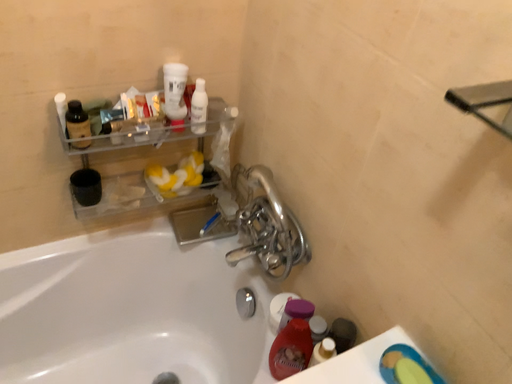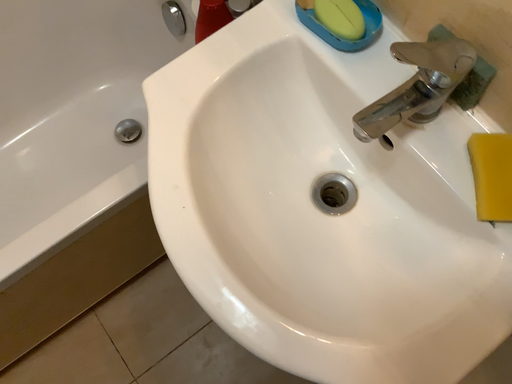
Question: How did the camera likely rotate when shooting the video?

Choices:
 (A) rotated upward
 (B) rotated downward

Answer: (B)